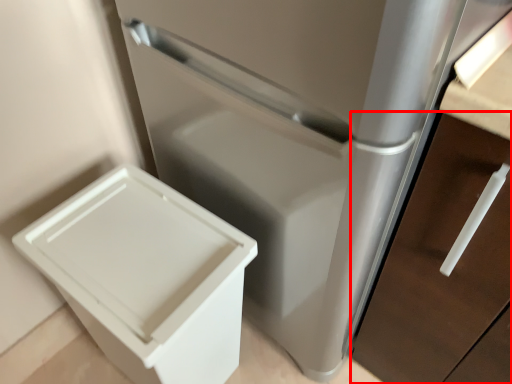
Question: Considering the relative positions of drawer (annotated by the red box) and waste container in the image provided, where is drawer (annotated by the red box) located with respect to the staircase?

Choices:
 (A) left
 (B) right

Answer: (B)